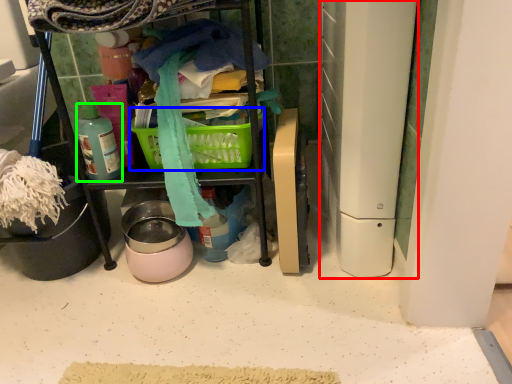
Question: Considering the real-world distances, which object is farthest from appliance (highlighted by a red box)? picnic basket (highlighted by a blue box) or bottle (highlighted by a green box)?

Choices:
 (A) picnic basket
 (B) bottle

Answer: (B)